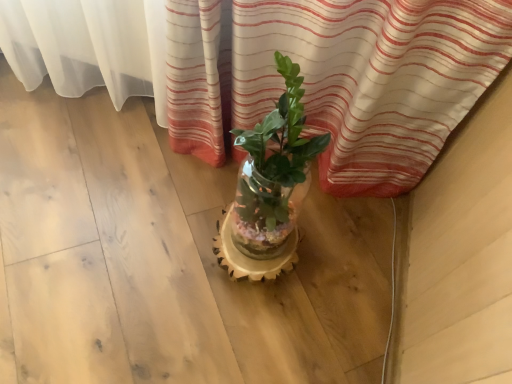
Question: Can you confirm if translucent glass vase at center is smaller than translucent glass vase at center?

Choices:
 (A) yes
 (B) no

Answer: (A)

Question: Considering the relative sizes of translucent glass vase at center and translucent glass vase at center in the image provided, is translucent glass vase at center wider than translucent glass vase at center?

Choices:
 (A) yes
 (B) no

Answer: (A)

Question: Does translucent glass vase at center turn towards translucent glass vase at center?

Choices:
 (A) yes
 (B) no

Answer: (B)

Question: Is translucent glass vase at center at the right side of translucent glass vase at center?

Choices:
 (A) yes
 (B) no

Answer: (B)

Question: Can you confirm if translucent glass vase at center is taller than translucent glass vase at center?

Choices:
 (A) no
 (B) yes

Answer: (A)

Question: From the image's perspective, would you say translucent glass vase at center is positioned over translucent glass vase at center?

Choices:
 (A) yes
 (B) no

Answer: (B)

Question: Is translucent glass vase at center surrounded by translucent glass vase at center?

Choices:
 (A) no
 (B) yes

Answer: (A)

Question: From the image's perspective, is translucent glass vase at center on translucent glass vase at center?

Choices:
 (A) yes
 (B) no

Answer: (A)

Question: Is translucent glass vase at center taller than translucent glass vase at center?

Choices:
 (A) no
 (B) yes

Answer: (B)

Question: From a real-world perspective, does translucent glass vase at center stand above translucent glass vase at center?

Choices:
 (A) yes
 (B) no

Answer: (A)

Question: Would you consider translucent glass vase at center to be distant from translucent glass vase at center?

Choices:
 (A) no
 (B) yes

Answer: (A)

Question: Is the position of translucent glass vase at center less distant than that of translucent glass vase at center?

Choices:
 (A) no
 (B) yes

Answer: (B)

Question: From the image's perspective, is translucent glass vase at center above or below translucent glass vase at center?

Choices:
 (A) below
 (B) above

Answer: (A)